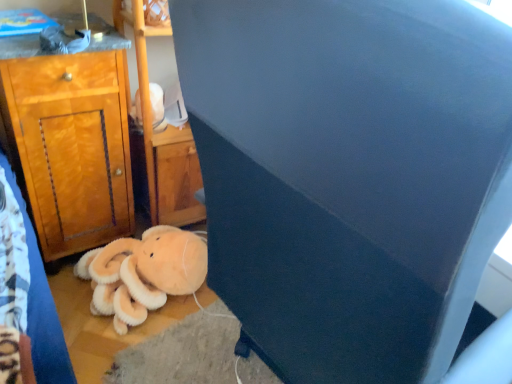
Question: Is wooden cabinet at left thinner than soft orange plush at lower left?

Choices:
 (A) yes
 (B) no

Answer: (A)

Question: Is wooden cabinet at left at the left side of soft orange plush at lower left?

Choices:
 (A) no
 (B) yes

Answer: (B)

Question: Could soft orange plush at lower left be considered to be inside wooden cabinet at left?

Choices:
 (A) yes
 (B) no

Answer: (B)

Question: Is wooden cabinet at left wider than soft orange plush at lower left?

Choices:
 (A) yes
 (B) no

Answer: (B)

Question: Can you confirm if wooden cabinet at left is positioned to the right of soft orange plush at lower left?

Choices:
 (A) yes
 (B) no

Answer: (B)

Question: From the image's perspective, is dark blue fabric at center above or below wooden cabinet at left?

Choices:
 (A) above
 (B) below

Answer: (B)

Question: Looking at the image, does dark blue fabric at center seem bigger or smaller compared to wooden cabinet at left?

Choices:
 (A) small
 (B) big

Answer: (B)

Question: Considering the positions of dark blue fabric at center and wooden cabinet at left in the image, is dark blue fabric at center wider or thinner than wooden cabinet at left?

Choices:
 (A) thin
 (B) wide

Answer: (B)

Question: Does point (389, 326) appear closer or farther from the camera than point (102, 137)?

Choices:
 (A) closer
 (B) farther

Answer: (A)

Question: Is soft orange plush at lower left in front of or behind white plush toy at upper center in the image?

Choices:
 (A) behind
 (B) front

Answer: (B)

Question: From the image's perspective, is soft orange plush at lower left located above or below white plush toy at upper center?

Choices:
 (A) below
 (B) above

Answer: (A)

Question: Considering the positions of soft orange plush at lower left and white plush toy at upper center in the image, is soft orange plush at lower left bigger or smaller than white plush toy at upper center?

Choices:
 (A) small
 (B) big

Answer: (B)

Question: From a real-world perspective, relative to white plush toy at upper center, is soft orange plush at lower left vertically above or below?

Choices:
 (A) above
 (B) below

Answer: (B)

Question: Is wooden cabinet at left in front of or behind soft orange plush at lower left in the image?

Choices:
 (A) behind
 (B) front

Answer: (B)

Question: Is wooden cabinet at left taller or shorter than soft orange plush at lower left?

Choices:
 (A) short
 (B) tall

Answer: (B)